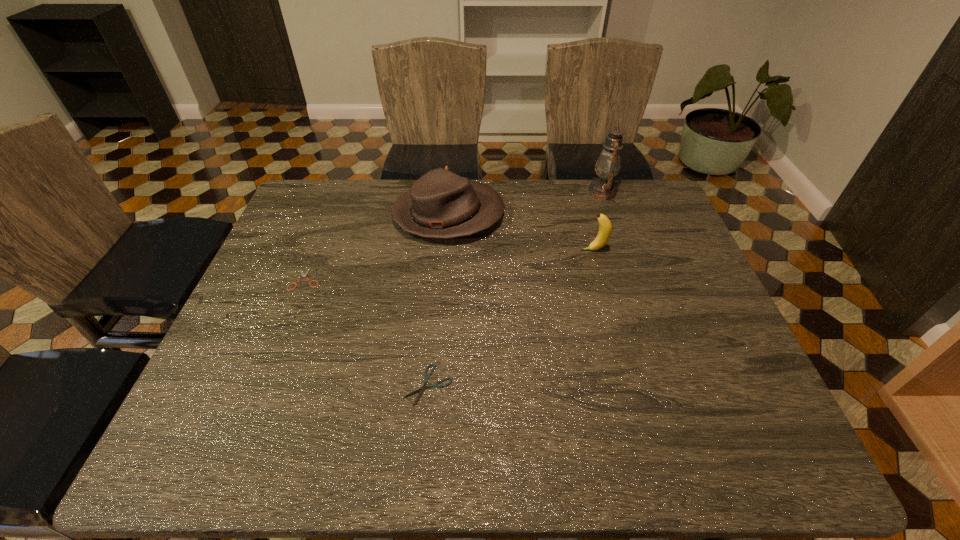
Find the location of a particular element. The image size is (960, 540). free space at the near edge of the desktop is located at coordinates (401, 460).

Image resolution: width=960 pixels, height=540 pixels. Find the location of `vacant space at the left edge of the desktop`. vacant space at the left edge of the desktop is located at coordinates (320, 256).

I want to click on free spot at the right edge of the desktop, so click(702, 314).

The width and height of the screenshot is (960, 540). Identify the location of blank space at the far left corner of the desktop. (336, 213).

Find the location of `vacant space at the far right corner`. vacant space at the far right corner is located at coordinates tap(636, 198).

Locate an element on the screen. The height and width of the screenshot is (540, 960). unoccupied position between the right shears and the tallest object is located at coordinates (516, 288).

The image size is (960, 540). I want to click on unoccupied position between the banana and the tallest object, so click(598, 221).

Identify the location of free area in between the tallest object and the nearest object. (516, 288).

You are a GUI agent. You are given a task and a screenshot of the screen. Output one action in this format:
    pyautogui.click(x=<x>, y=<y>)
    Task: Click on the free area in between the hat and the farther shears
    This screenshot has height=540, width=960.
    Given the screenshot: What is the action you would take?
    pyautogui.click(x=377, y=247)

Locate an element on the screen. The image size is (960, 540). vacant space that is in between the tallest object and the banana is located at coordinates (598, 221).